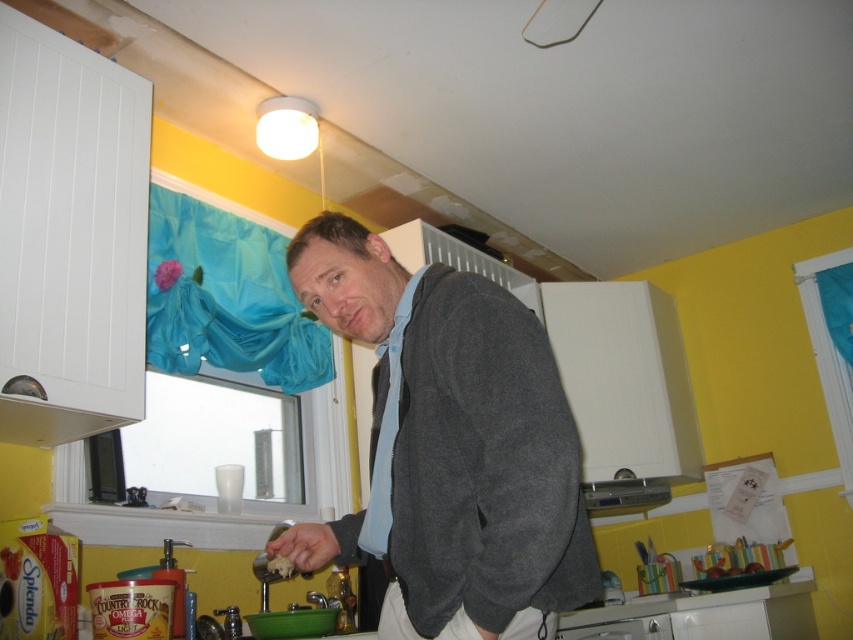
Who is shorter, gray wool sweater at center or white crumbly food at lower center?

white crumbly food at lower center

At what (x,y) coordinates should I click in order to perform the action: click on gray wool sweater at center. Please return your answer as a coordinate pair (x, y). Looking at the image, I should click on (450, 444).